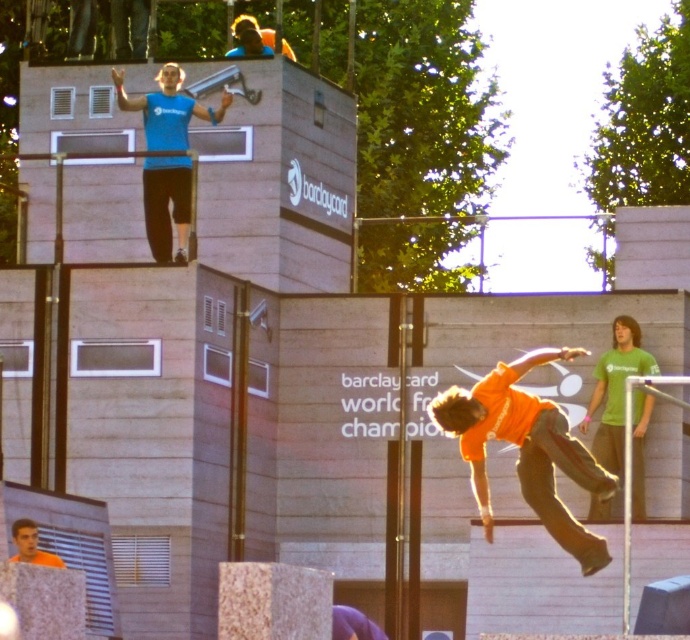
You are a photographer at the skateboarding event. You need to capture a photo that includes both the matte blue shirt at upper center and the orange shirt at center. Based on their positions, which shirt should you focus on first to ensure both are in frame?

The matte blue shirt at upper center is above the orange shirt at center, so you should focus on the orange shirt at center first to ensure both are in frame.

You are a photographer at the skateboarding event. You need to capture a photo of both the orange cotton shirt at center and the orange shirt at center in the same frame. Which of the two shirts should you focus on first to ensure they both fit in the shot?

A: The orange cotton shirt at center is not as tall as orange shirt at center, so you should focus on the taller orange shirt at center first to ensure both fit in the frame.